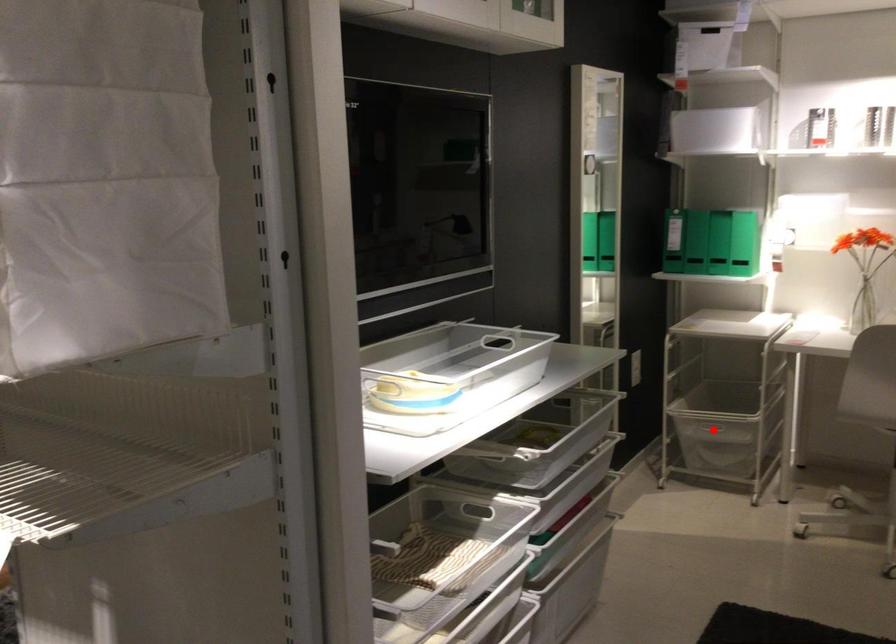
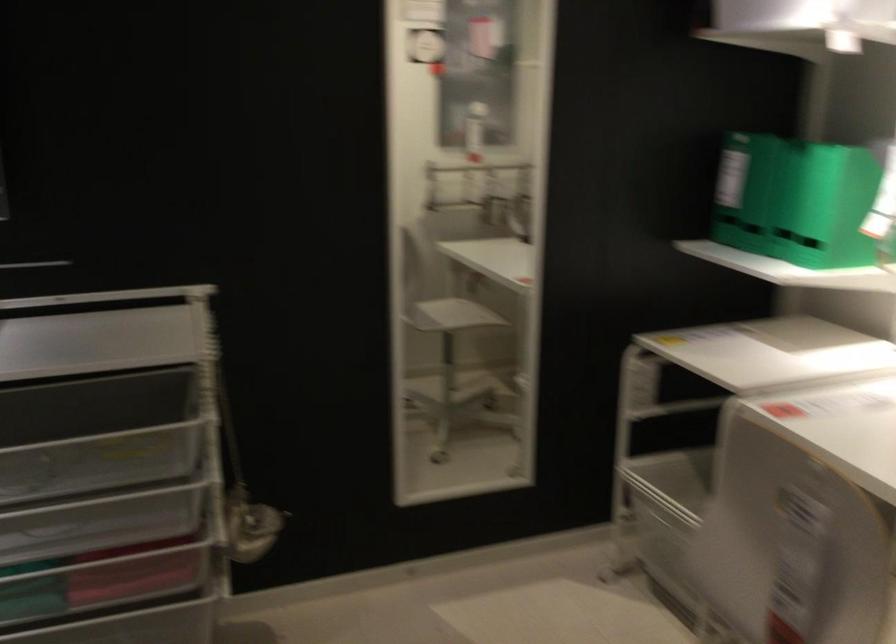
Question: I am providing you with two images of the same scene from different viewpoints. A red point is marked on the first image. Is the red point's position out of view in image 2?

Choices:
 (A) Yes
 (B) No

Answer: (A)